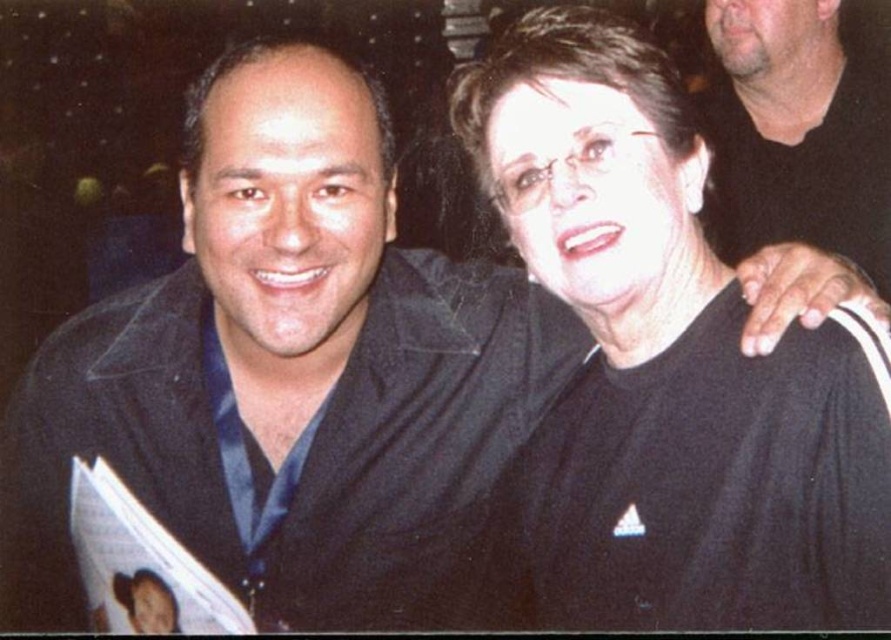
Question: Does black matte shirt at center appear on the right side of dark gray shirt at upper right?

Choices:
 (A) yes
 (B) no

Answer: (B)

Question: Observing the image, what is the correct spatial positioning of black matte shirt at center in reference to dark gray shirt at upper right?

Choices:
 (A) right
 (B) left

Answer: (B)

Question: Does black matte shirt at center have a greater width compared to dark gray shirt at upper right?

Choices:
 (A) no
 (B) yes

Answer: (B)

Question: Which of the following is the closest to the observer?

Choices:
 (A) (x=741, y=220)
 (B) (x=569, y=132)

Answer: (B)

Question: Among these objects, which one is nearest to the camera?

Choices:
 (A) dark gray shirt at upper right
 (B) black matte shirt at center

Answer: (B)